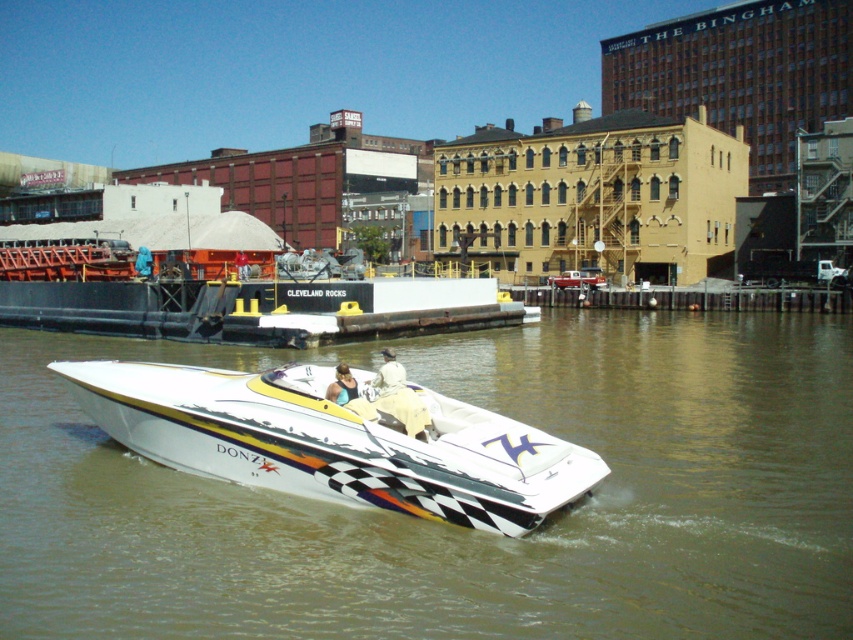
Does white glossy speedboat at center appear under tan fabric jacket at center?

No.

Describe the element at coordinates (335, 442) in the screenshot. The height and width of the screenshot is (640, 853). I see `white glossy speedboat at center` at that location.

Who is more distant from viewer, (323,401) or (387,397)?

The point (387,397) is behind.

This screenshot has width=853, height=640. I want to click on white glossy speedboat at center, so click(335, 442).

Can you confirm if white glossy water at center is positioned to the left of white glossy speedboat at center?

Incorrect, white glossy water at center is not on the left side of white glossy speedboat at center.

Is point (572, 428) farther from camera compared to point (474, 506)?

Yes.

Which is behind, point (775, 636) or point (161, 394)?

Positioned behind is point (161, 394).

Identify the location of white glossy water at center. (459, 528).

Which of these two, white glossy water at center or tan fabric jacket at center, stands shorter?

Standing shorter between the two is tan fabric jacket at center.

Does point (554, 432) come closer to viewer compared to point (375, 401)?

No, it is behind (375, 401).

What are the coordinates of `white glossy water at center` in the screenshot? It's located at (459, 528).